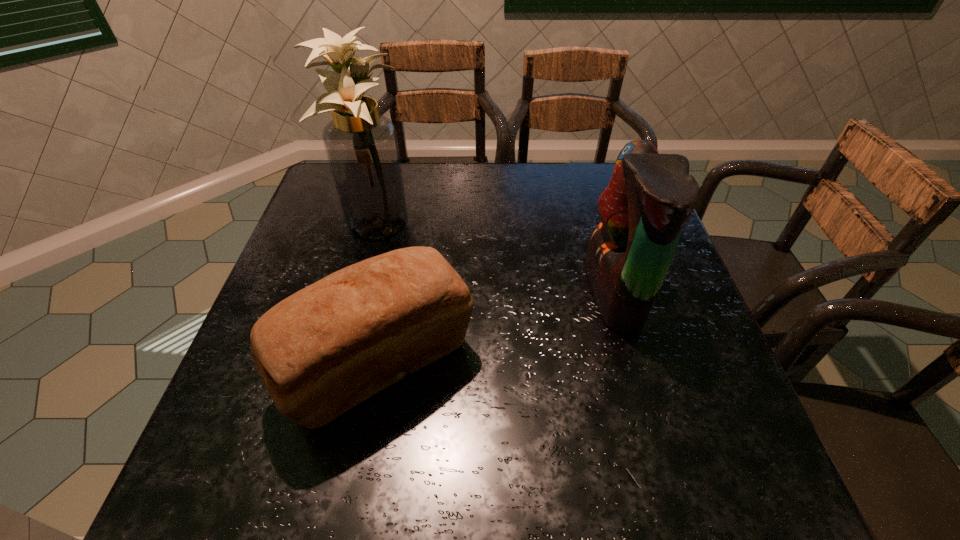
The image size is (960, 540). What are the coordinates of `the tallest object` in the screenshot? It's located at (361, 145).

You are a GUI agent. You are given a task and a screenshot of the screen. Output one action in this format:
    pyautogui.click(x=<x>, y=<y>)
    Task: Click on the second shortest object
    
    Given the screenshot: What is the action you would take?
    pyautogui.click(x=650, y=197)

Identify the location of parrot. (650, 197).

This screenshot has width=960, height=540. Identify the location of bread. (328, 347).

This screenshot has height=540, width=960. What are the coordinates of `vacant space located 0.170m on the right of the flower arrangement` in the screenshot? It's located at (474, 223).

Where is `vacant region located 0.150m at the face of the rightmost object`? Image resolution: width=960 pixels, height=540 pixels. vacant region located 0.150m at the face of the rightmost object is located at coordinates (522, 292).

This screenshot has width=960, height=540. Identify the location of free space located 0.240m at the face of the rightmost object. (483, 292).

Identify the location of blank space located 0.180m at the face of the rightmost object. This screenshot has height=540, width=960. (510, 292).

Locate an element on the screen. This screenshot has width=960, height=540. free spot located 0.110m on the right of the shortest object is located at coordinates (530, 367).

Find the location of a particular element. This screenshot has height=540, width=960. object at the far edge is located at coordinates (361, 145).